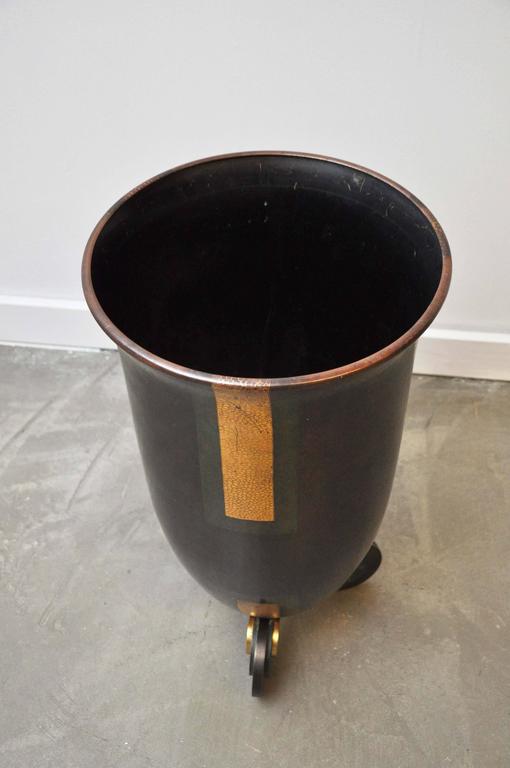
The width and height of the screenshot is (510, 768). I want to click on floor, so click(84, 712).